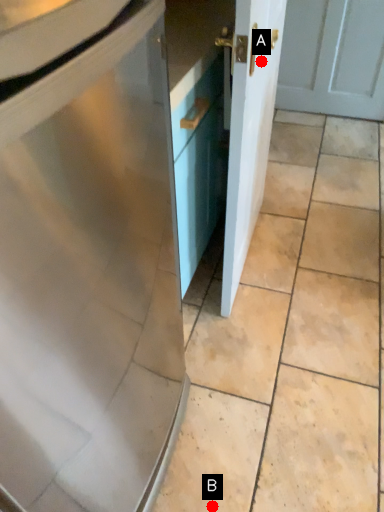
Question: Two points are circled on the image, labeled by A and B beside each circle. Which point is closer to the camera taking this photo?

Choices:
 (A) A is closer
 (B) B is closer

Answer: (B)